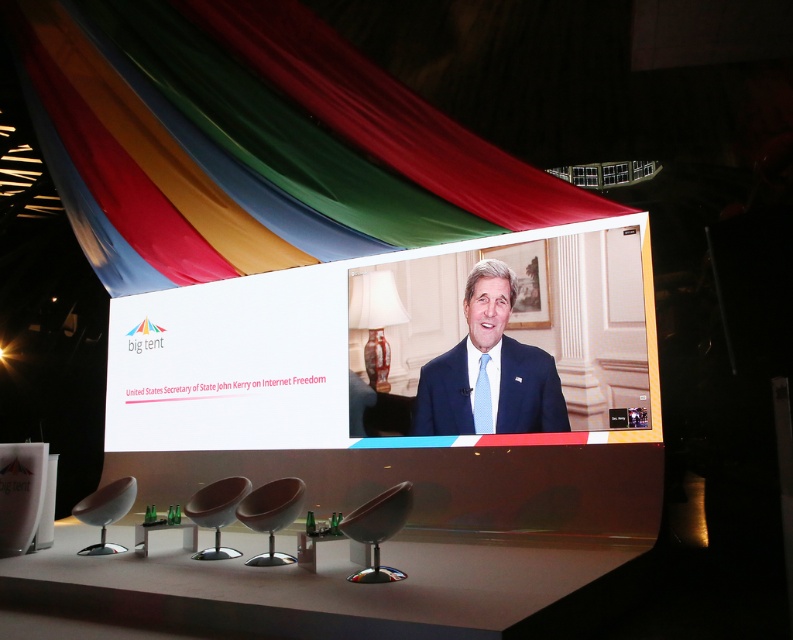
You are an event planner assessing the stage setup. You notice the blue textured suit at center and the white glossy chair at lower left. Which object is taller?

The blue textured suit at center is taller than the white glossy chair at lower left.

You are an event organizer arranging a virtual meeting. You need to ensure that the matte black chair at center is visible to the attendees. Since the blue textured suit at center is in front of it, where should you position the camera to capture both objects clearly?

The matte black chair at center is behind the blue textured suit at center. To ensure both are visible, position the camera so it can capture the blue textured suit at center in the foreground and the matte black chair at center in the background without obstruction.